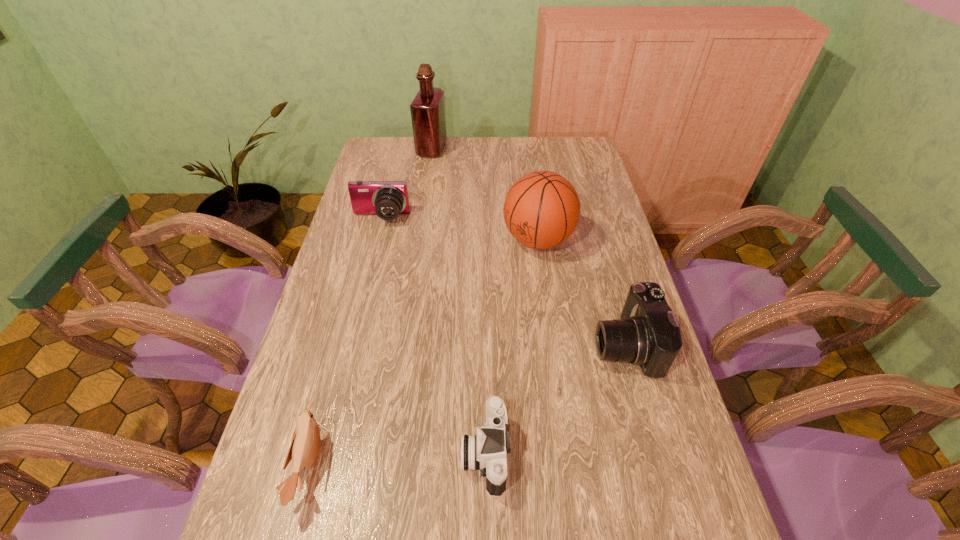
The width and height of the screenshot is (960, 540). I want to click on the tallest object, so click(x=427, y=109).

At what (x,y) coordinates should I click in order to perform the action: click on liquor. Please return your answer as a coordinate pair (x, y). Image resolution: width=960 pixels, height=540 pixels. Looking at the image, I should click on (427, 109).

The image size is (960, 540). In order to click on basketball in this screenshot , I will do `click(541, 210)`.

You are a GUI agent. You are given a task and a screenshot of the screen. Output one action in this format:
    pyautogui.click(x=<x>, y=<y>)
    Task: Click on the rightmost camera
    The height and width of the screenshot is (540, 960).
    Given the screenshot: What is the action you would take?
    pyautogui.click(x=647, y=334)

Image resolution: width=960 pixels, height=540 pixels. Find the location of `the fourth farthest object`. the fourth farthest object is located at coordinates (647, 334).

This screenshot has width=960, height=540. In order to click on the farthest camera in this screenshot , I will do `click(387, 199)`.

At what (x,y) coordinates should I click in order to perform the action: click on the second camera from right to left. Please return your answer as a coordinate pair (x, y). The height and width of the screenshot is (540, 960). Looking at the image, I should click on (486, 451).

Locate an element on the screen. The height and width of the screenshot is (540, 960). the nearest camera is located at coordinates (486, 451).

Find the location of `bird`. bird is located at coordinates (305, 446).

The width and height of the screenshot is (960, 540). What are the coordinates of `free space located on the front of the liquor` in the screenshot? It's located at (421, 217).